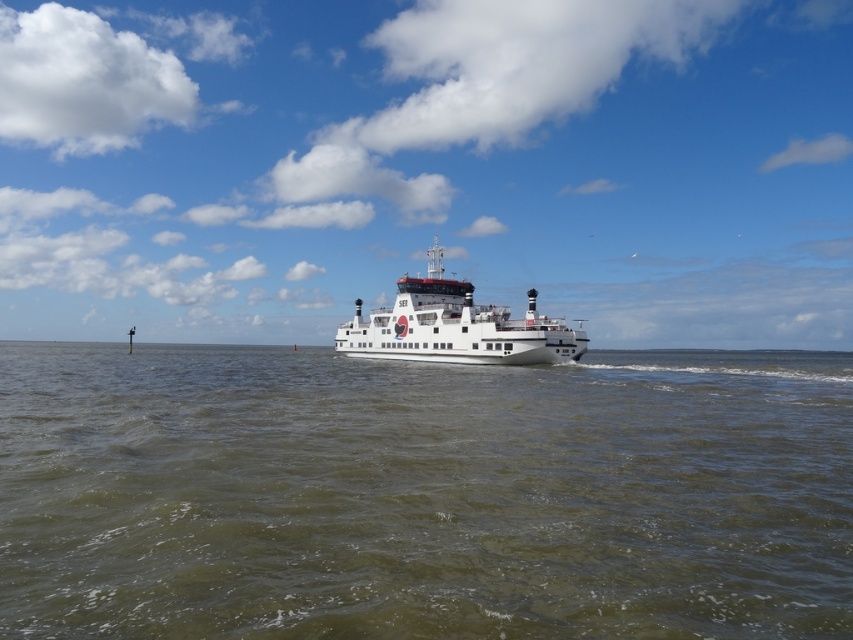
Question: Does greenish water at center appear under white glossy ferry at center?

Choices:
 (A) yes
 (B) no

Answer: (A)

Question: Among these points, which one is farthest from the camera?

Choices:
 (A) (440, 276)
 (B) (828, 369)

Answer: (A)

Question: Which object is closer to the camera taking this photo?

Choices:
 (A) white glossy ferry at center
 (B) greenish water at center

Answer: (B)

Question: Does greenish water at center lie behind white glossy ferry at center?

Choices:
 (A) no
 (B) yes

Answer: (A)

Question: Does greenish water at center come behind white glossy ferry at center?

Choices:
 (A) yes
 (B) no

Answer: (B)

Question: Which point appears closest to the camera in this image?

Choices:
 (A) (625, 596)
 (B) (486, 353)

Answer: (A)